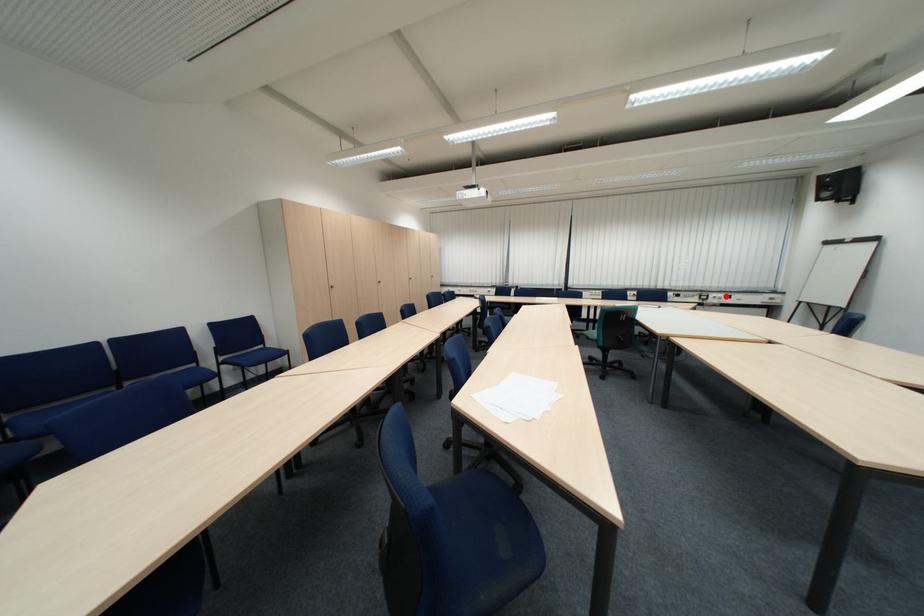
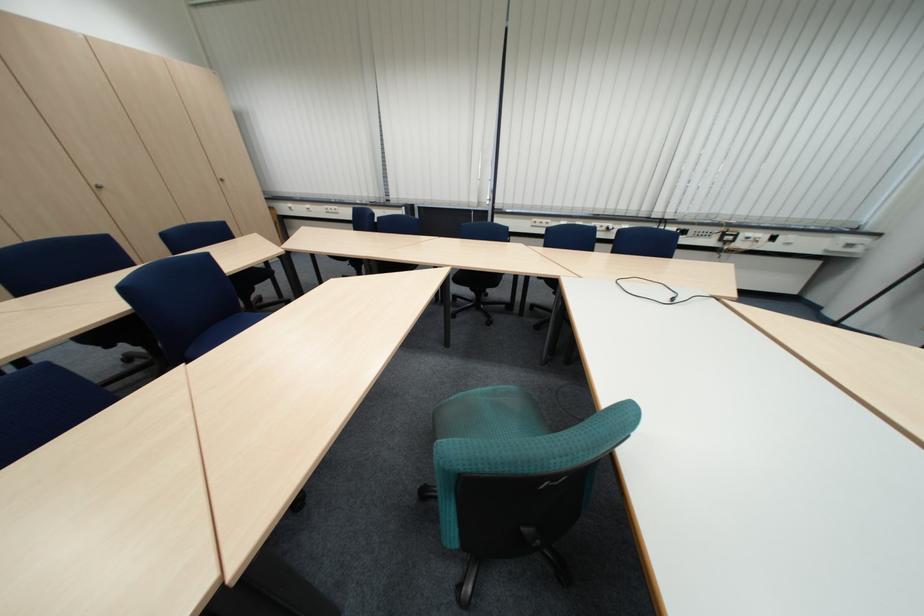
Locate, in the second image, the point that corresponds to the highlighted location in the first image.

(759, 235)